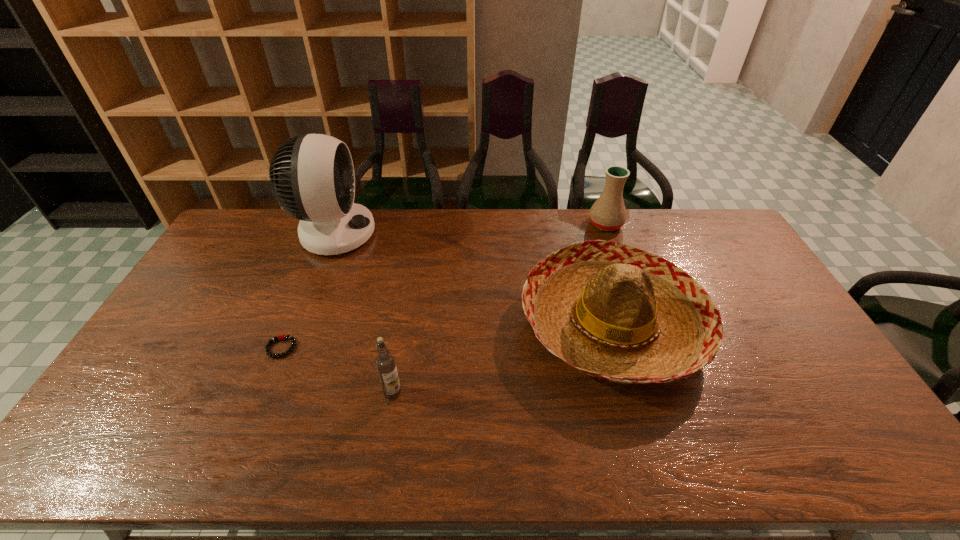
The width and height of the screenshot is (960, 540). I want to click on fan, so (312, 177).

Locate an element on the screen. pottery is located at coordinates (608, 213).

Locate an element on the screen. The height and width of the screenshot is (540, 960). vodka is located at coordinates (385, 363).

The image size is (960, 540). I want to click on sombrero, so click(617, 313).

The image size is (960, 540). I want to click on the shortest object, so click(x=281, y=337).

Image resolution: width=960 pixels, height=540 pixels. In order to click on blank space located 0.390m on the grille of the fan in this screenshot , I will do `click(478, 233)`.

Identify the location of free location located on the left of the pottery. (549, 224).

You are a GUI agent. You are given a task and a screenshot of the screen. Output one action in this format:
    pyautogui.click(x=<x>, y=<y>)
    Task: Click on the blank area located 0.090m on the label of the vodka
    
    Given the screenshot: What is the action you would take?
    pyautogui.click(x=386, y=433)

Where is `vacant area situated 0.180m on the right of the sombrero`? vacant area situated 0.180m on the right of the sombrero is located at coordinates (763, 323).

Image resolution: width=960 pixels, height=540 pixels. Identify the location of free location located on the front of the bracelet. (236, 456).